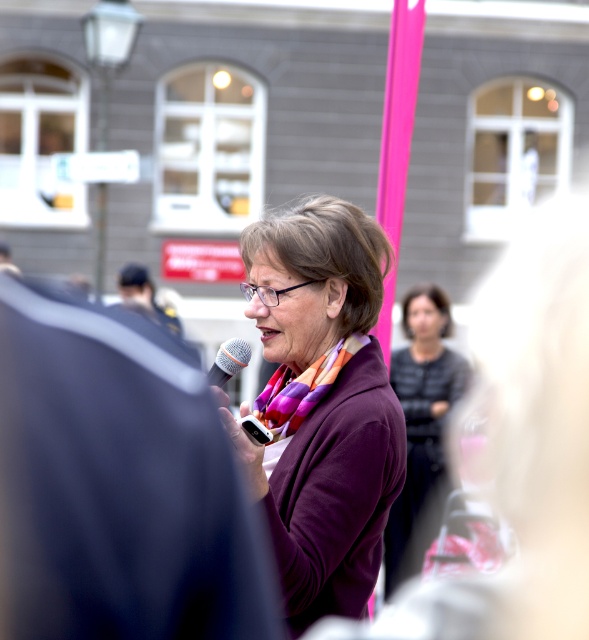
Can you confirm if purple fabric scarf at center is wider than silver metallic microphone at center?

No.

Is point (435, 346) closer to viewer compared to point (223, 369)?

No, (435, 346) is further to viewer.

Find the location of a particular element. purple fabric scarf at center is located at coordinates (421, 417).

Between purple soft sweater at center and purple fabric scarf at center, which one appears on the left side from the viewer's perspective?

Positioned to the left is purple soft sweater at center.

Consider the image. Is purple soft sweater at center thinner than purple fabric scarf at center?

In fact, purple soft sweater at center might be wider than purple fabric scarf at center.

Is point (299, 476) positioned before point (391, 385)?

Yes, it is.

Identify the location of purple soft sweater at center. (322, 404).

Between purple fabric scarf at center and multicolored woven scarf at center, which one is positioned lower?

purple fabric scarf at center is lower down.

Find the location of `purple fabric scarf at center`. purple fabric scarf at center is located at coordinates [421, 417].

Locate an element on the screen. The height and width of the screenshot is (640, 589). purple fabric scarf at center is located at coordinates (421, 417).